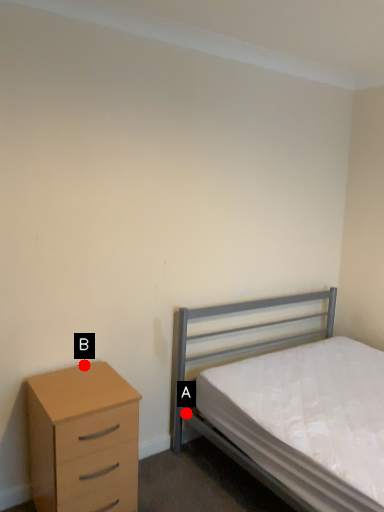
Question: Two points are circled on the image, labeled by A and B beside each circle. Which of the following is the farthest from the observer?

Choices:
 (A) A is further
 (B) B is further

Answer: (A)